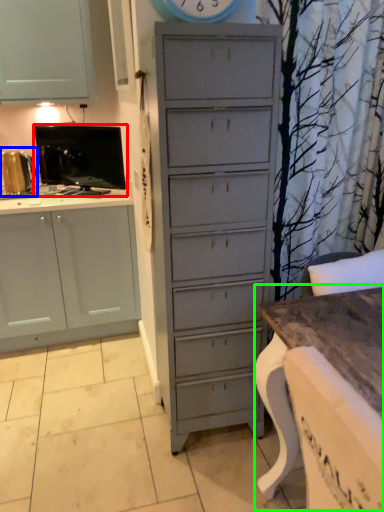
Question: Which object is positioned farthest from appliance (highlighted by a red box)? Select from appliance (highlighted by a blue box) and table (highlighted by a green box).

Choices:
 (A) appliance
 (B) table

Answer: (B)